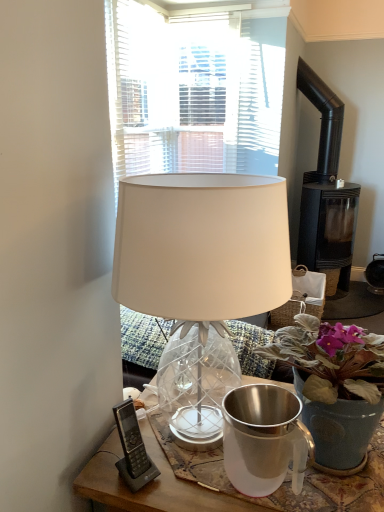
Question: In terms of height, does white glass lamp at center look taller or shorter compared to black plastic phone at lower left?

Choices:
 (A) tall
 (B) short

Answer: (A)

Question: From a real-world perspective, relative to black plastic phone at lower left, is white glass lamp at center vertically above or below?

Choices:
 (A) above
 (B) below

Answer: (A)

Question: Based on their relative distances, which object is farther from the black matte fireplace at right?

Choices:
 (A) white glass lamp at center
 (B) black plastic phone at lower left
 (C) matte blue pot at center
 (D) shiny metallic jug at center

Answer: (B)

Question: Estimate the real-world distances between objects in this image. Which object is closer to the black plastic phone at lower left?

Choices:
 (A) white glass lamp at center
 (B) shiny metallic jug at center
 (C) black matte fireplace at right
 (D) matte blue pot at center

Answer: (B)